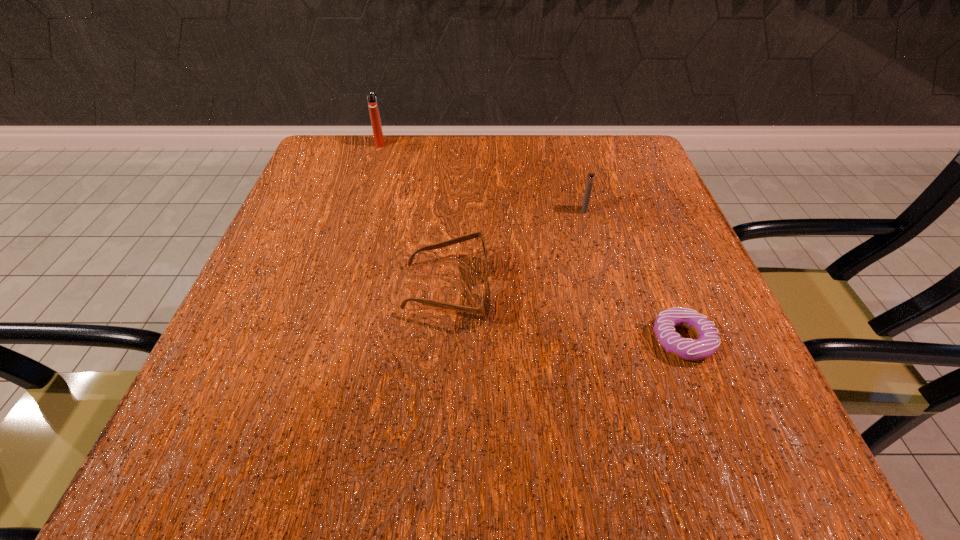
Where is `vacant region at the right edge of the desktop`? vacant region at the right edge of the desktop is located at coordinates (691, 265).

At what (x,y) coordinates should I click in order to perform the action: click on free space at the far left corner of the desktop. Please return your answer as a coordinate pair (x, y). The height and width of the screenshot is (540, 960). Looking at the image, I should click on (360, 143).

At what (x,y) coordinates should I click in order to perform the action: click on vacant space at the near left corner of the desktop. Please return your answer as a coordinate pair (x, y). The image size is (960, 540). Looking at the image, I should click on (243, 422).

Where is `unoccupied area between the third object from right to left and the third object from left to right`? unoccupied area between the third object from right to left and the third object from left to right is located at coordinates (516, 249).

Where is `vacant point located between the third nearest object and the farthest object`? vacant point located between the third nearest object and the farthest object is located at coordinates (482, 177).

This screenshot has height=540, width=960. What are the coordinates of `blank region between the rightmost object and the second object from left to right` in the screenshot? It's located at (565, 315).

This screenshot has height=540, width=960. In order to click on vacant space that is in between the rightmost object and the sunglasses in this screenshot , I will do `click(565, 315)`.

Image resolution: width=960 pixels, height=540 pixels. I want to click on free spot between the third object from right to left and the third object from left to right, so click(516, 249).

You are a GUI agent. You are given a task and a screenshot of the screen. Output one action in this format:
    pyautogui.click(x=<x>, y=<y>)
    Task: Click on the blank region between the tallest object and the shortest object
    
    Given the screenshot: What is the action you would take?
    click(531, 241)

Locate an element on the screen. The height and width of the screenshot is (540, 960). empty location between the sunglasses and the shortest object is located at coordinates coord(565,315).